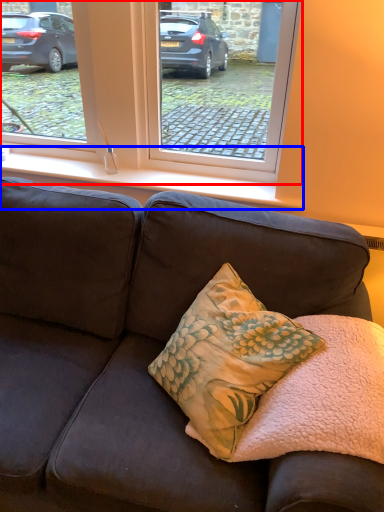
Question: Which of the following is the farthest to the observer, window (highlighted by a red box) or window sill (highlighted by a blue box)?

Choices:
 (A) window
 (B) window sill

Answer: (B)